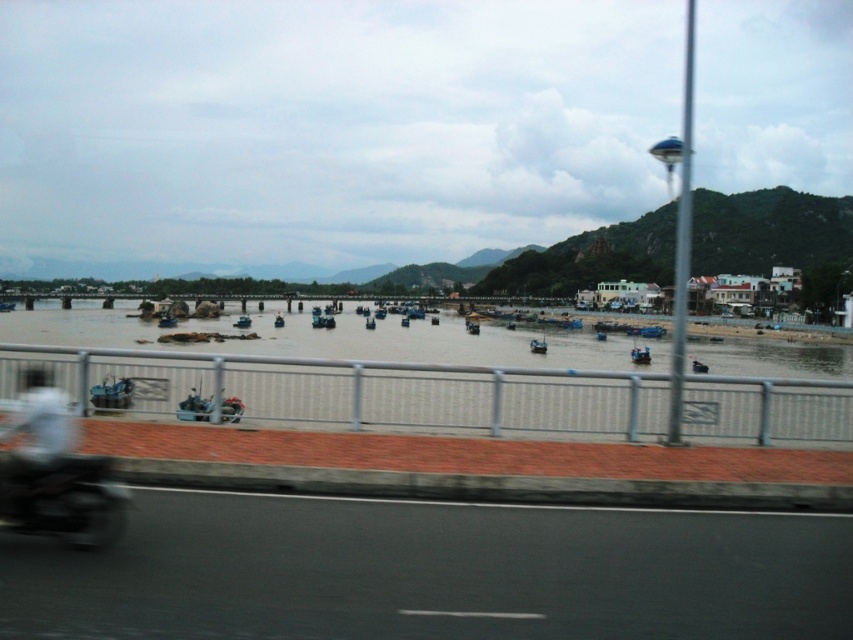
Question: Is black asphalt road at lower center behind metallic gray fence at lower center?

Choices:
 (A) no
 (B) yes

Answer: (A)

Question: Among these points, which one is nearest to the camera?

Choices:
 (A) (62, 428)
 (B) (407, 513)
 (C) (61, 516)
 (D) (814, 406)

Answer: (C)

Question: Which point is closer to the camera?

Choices:
 (A) (305, 385)
 (B) (25, 440)
 (C) (485, 620)

Answer: (C)

Question: Is the position of metallic gray fence at lower center more distant than that of shiny black motorcycle at lower left?

Choices:
 (A) yes
 (B) no

Answer: (A)

Question: Does shiny black motorcycle at lower left come behind white matte helmet at upper left?

Choices:
 (A) yes
 (B) no

Answer: (B)

Question: Which point appears farthest from the camera in this image?

Choices:
 (A) (56, 508)
 (B) (485, 429)
 (C) (610, 508)
 (D) (44, 452)

Answer: (B)